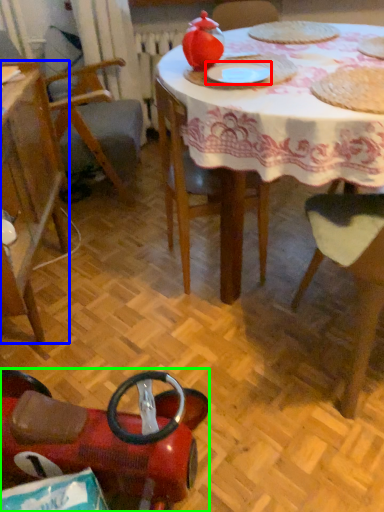
Question: Estimate the real-world distances between objects in this image. Which object is closer to paper plate (highlighted by a red box), chair (highlighted by a blue box) or chair (highlighted by a green box)?

Choices:
 (A) chair
 (B) chair

Answer: (A)